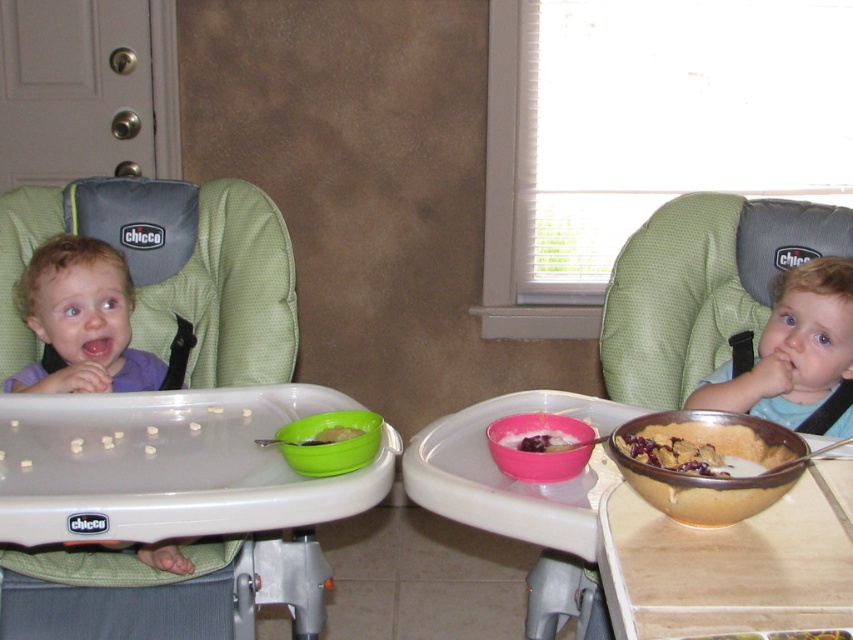
Question: Which point appears closest to the camera in this image?

Choices:
 (A) (321, 442)
 (B) (784, 352)
 (C) (53, 305)
 (D) (515, 444)

Answer: (D)

Question: Which point is closer to the camera?

Choices:
 (A) (555, 451)
 (B) (93, 346)
 (C) (683, 408)

Answer: (A)

Question: Which of the following is the closest to the observer?

Choices:
 (A) green plastic bowl at center
 (B) blue matte shirt at upper right
 (C) smooth pink bowl at center

Answer: (C)

Question: Is matte purple shirt at left in front of golden brown crumbly pie at right?

Choices:
 (A) no
 (B) yes

Answer: (A)

Question: Considering the relative positions of blue matte shirt at upper right and golden brown crumbly pie at right in the image provided, where is blue matte shirt at upper right located with respect to golden brown crumbly pie at right?

Choices:
 (A) below
 (B) above

Answer: (B)

Question: Does blue matte shirt at upper right have a greater width compared to smooth pink bowl at center?

Choices:
 (A) no
 (B) yes

Answer: (B)